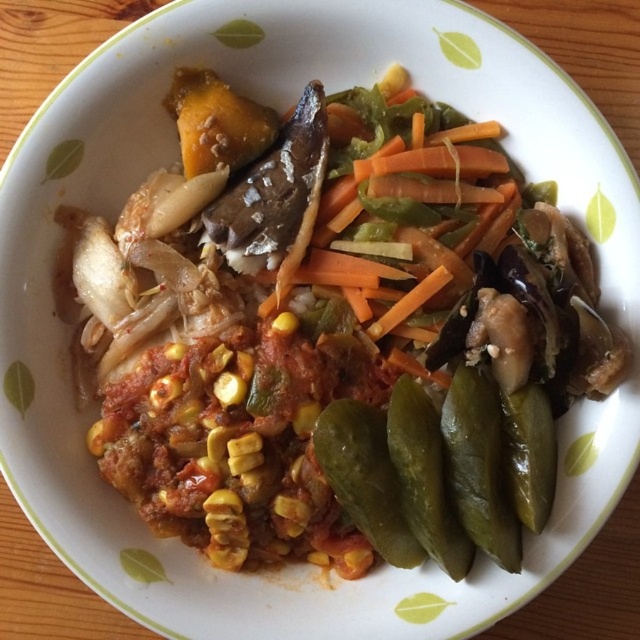
Describe the element at coordinates (477, 465) in the screenshot. I see `green glossy pickles at lower right` at that location.

Does green glossy pickles at lower right appear on the right side of green glossy pickles at bottom right?

Indeed, green glossy pickles at lower right is positioned on the right side of green glossy pickles at bottom right.

What do you see at coordinates (477, 465) in the screenshot? I see `green glossy pickles at lower right` at bounding box center [477, 465].

The width and height of the screenshot is (640, 640). I want to click on green glossy pickles at lower right, so click(x=477, y=465).

Measure the distance from green glossy pickles at lower right to green pickled vegetable at center.

green glossy pickles at lower right and green pickled vegetable at center are 5.24 inches apart from each other.

Locate an element on the screen. green glossy pickles at lower right is located at coordinates (477, 465).

How much distance is there between green pickled vegetable at center and green glossy pickles at bottom right?

The distance of green pickled vegetable at center from green glossy pickles at bottom right is 1.95 inches.

Which is more to the left, green pickled vegetable at center or green glossy pickles at bottom right?

Positioned to the left is green pickled vegetable at center.

This screenshot has height=640, width=640. What are the coordinates of `green pickled vegetable at center` in the screenshot? It's located at (364, 477).